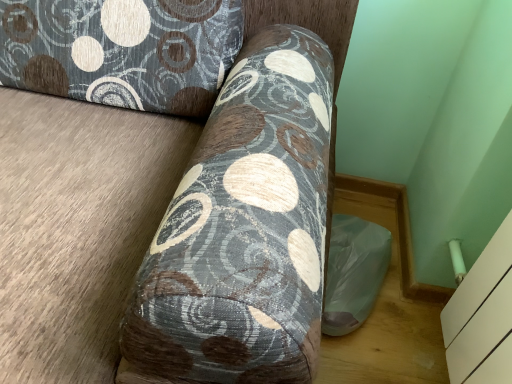
Where is `textured fabric couch at center`? textured fabric couch at center is located at coordinates (76, 228).

What do you see at coordinates (76, 228) in the screenshot?
I see `textured fabric couch at center` at bounding box center [76, 228].

Where is `textured fabric couch at center`? This screenshot has width=512, height=384. textured fabric couch at center is located at coordinates (76, 228).